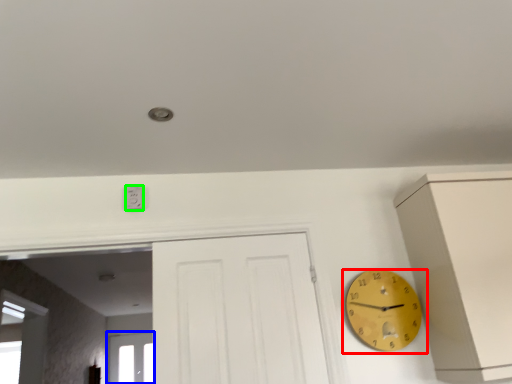
Question: Estimate the real-world distances between objects in this image. Which object is closer to wall clock (highlighted by a red box), window (highlighted by a blue box) or electric outlet (highlighted by a green box)?

Choices:
 (A) window
 (B) electric outlet

Answer: (B)